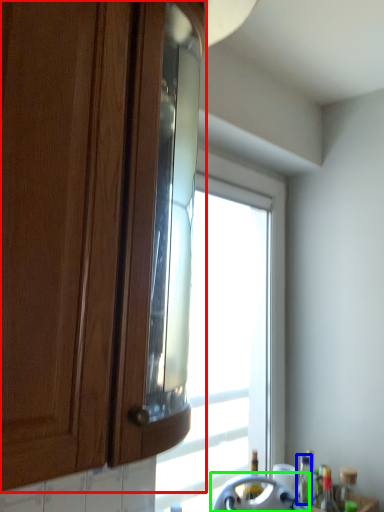
Question: Estimate the real-world distances between objects in this image. Which object is farther from cabinetry (highlighted by a red box), bottle (highlighted by a blue box) or appliance (highlighted by a green box)?

Choices:
 (A) bottle
 (B) appliance

Answer: (A)